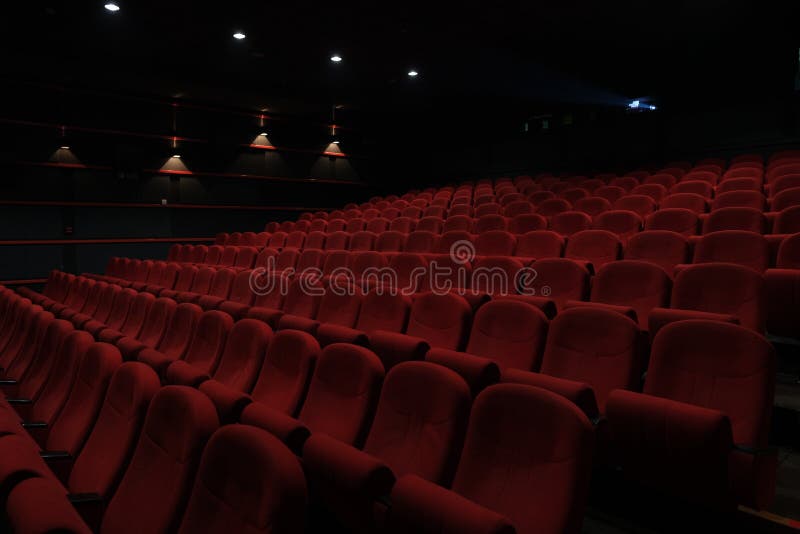
The image size is (800, 534). In order to click on light in this screenshot , I will do `click(70, 159)`, `click(172, 166)`, `click(262, 140)`, `click(336, 151)`, `click(412, 74)`, `click(334, 59)`, `click(238, 35)`, `click(112, 7)`, `click(634, 103)`, `click(652, 107)`.